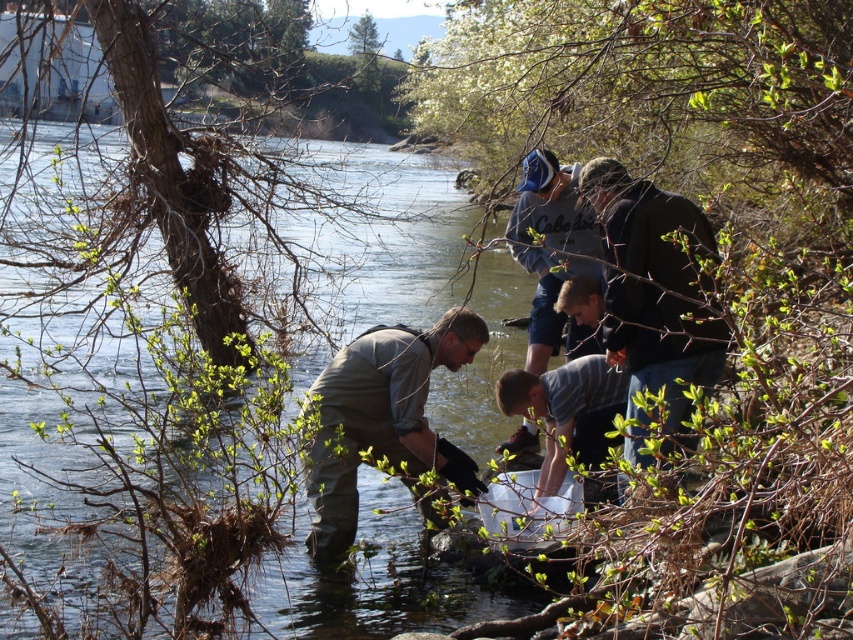
You are a photographer trying to capture a clear shot of the striped cotton shirt at center and the blue fabric cap at upper center. Since you want both subjects to be in focus, you need to know their relative heights. Which object is taller?

The blue fabric cap at upper center is taller than the striped cotton shirt at center.

You are a photographer trying to capture a clear shot of the striped cotton shirt at center. However, the blue fabric cap at upper center is blocking your view. Can you move the cap to the side to get a better angle?

The blue fabric cap at upper center is located above the striped cotton shirt at center, so moving it to the side might help, but since the cap is part of the scene, you might need to adjust your camera angle instead of moving objects.

Consider the image. You are part of a team working near the riverbank. You notice two team members wearing the matte gray shirt at center and the striped cotton shirt at center. Which team member is closer to you?

The matte gray shirt at center is closer to you because it is in front of the striped cotton shirt at center.